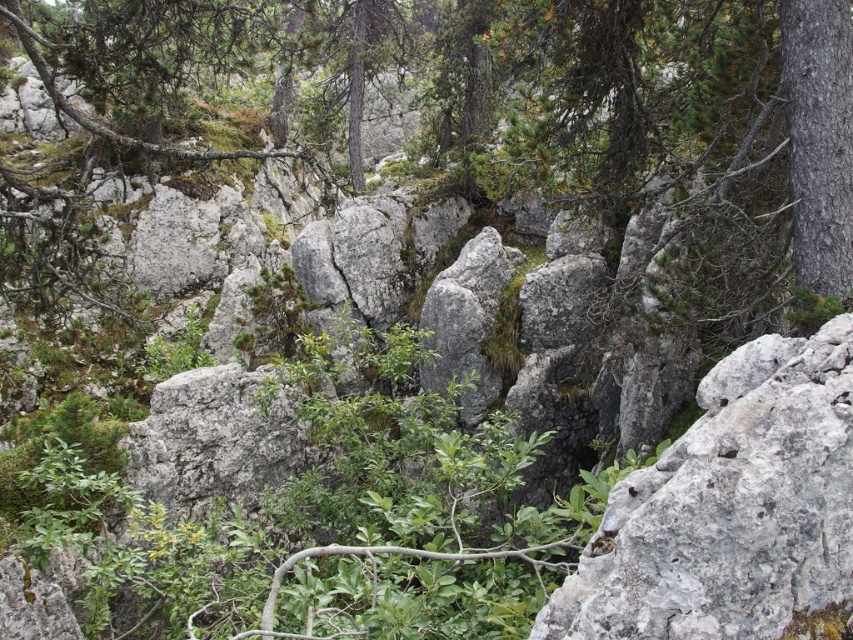
Question: Which of the following is the closest to the observer?

Choices:
 (A) smooth bark tree at right
 (B) gray rough rock at center

Answer: (B)

Question: Can you confirm if gray rough rock at center is smaller than smooth bark tree at right?

Choices:
 (A) no
 (B) yes

Answer: (A)

Question: Is gray rough rock at center further to the viewer compared to smooth bark tree at right?

Choices:
 (A) no
 (B) yes

Answer: (A)

Question: Among these points, which one is farthest from the camera?

Choices:
 (A) (x=817, y=132)
 (B) (x=756, y=608)

Answer: (A)

Question: Which point is closer to the camera?

Choices:
 (A) smooth bark tree at right
 (B) gray rough rock at center

Answer: (B)

Question: In this image, where is gray rough rock at center located relative to smooth bark tree at right?

Choices:
 (A) below
 (B) above

Answer: (A)